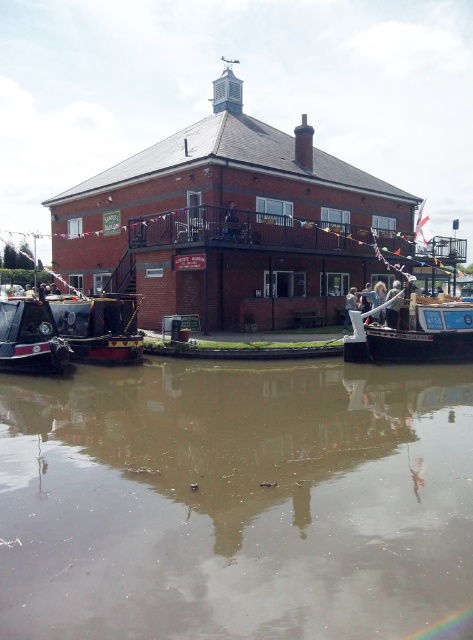
You are a tourist standing on the dock and want to board the wooden polished boat at center. Which direction should you walk from the matte black boat at left to reach it?

The wooden polished boat at center is to the right of the matte black boat at left, so you should walk to the right from the matte black boat at left to reach it.

You are a boat inspector checking the clearance height for two boats docked at the canal. The wooden polished boat at center and the matte black boat at left are both under a low bridge. Which boat is more likely to pass under the bridge without hitting it?

The matte black boat at left is more likely to pass under the bridge without hitting it because it has a lower height compared to the wooden polished boat at center.

You are a photographer planning to take a wide shot of the brown murky water at center and the wooden polished boat at center. Which one will occupy more space in the photo?

The brown murky water at center is bigger than the wooden polished boat at center, so it will occupy more space in the photo.